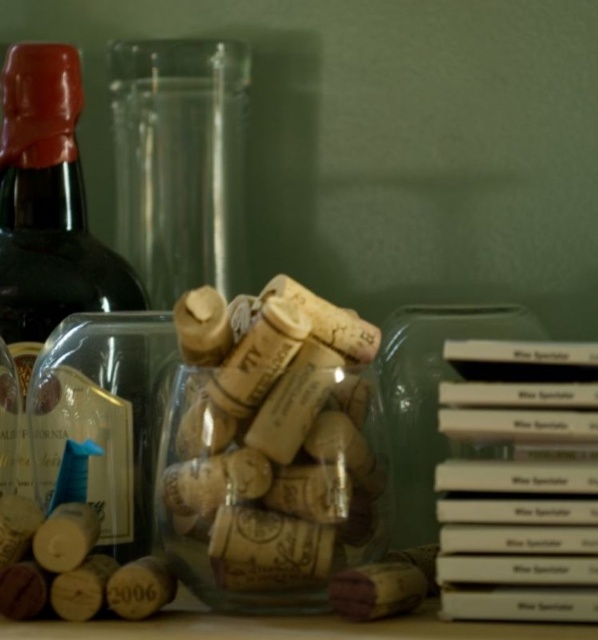
You are standing in front of the wine arrangement and want to reach for two points marked on the image. The first point is at coordinate point (71, 209) and the second is at point (411, 416). Which point will you need to extend your hand further to reach?

Point (411, 416) is further away from the viewer compared to point (71, 209), so you will need to extend your hand further to reach point (411, 416).

You are holding a small toy car that is 12 inches long. You want to place it on the surface where the matte dark green bottle at left is located. Will the toy car fit entirely on that surface without hanging over the edge?

The distance of matte dark green bottle at left from viewer is 14.54 inches. Since the toy car is 12 inches long, it will fit entirely on the surface as it is shorter than the available space.

Consider the image. You are trying to decide which container to use for storing small items. The matte dark green bottle at left and the transparent plastic jar at center are both options. Which one has a larger diameter?

The transparent plastic jar at center has a larger diameter than the matte dark green bottle at left because the matte dark green bottle at left is thinner.